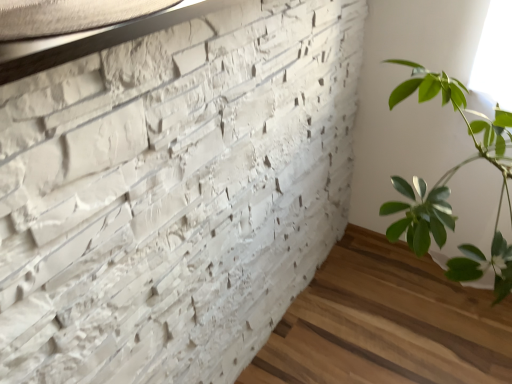
Locate an element on the screen. Image resolution: width=512 pixels, height=384 pixels. white textured brickwork at upper left is located at coordinates (174, 193).

What do you see at coordinates (174, 193) in the screenshot?
I see `white textured brickwork at upper left` at bounding box center [174, 193].

Find the location of a particular element. The height and width of the screenshot is (384, 512). matte white stone at upper left is located at coordinates (104, 40).

What is the approximate width of matte white stone at upper left?

The width of matte white stone at upper left is 15.54 inches.

Describe the element at coordinates (104, 40) in the screenshot. I see `matte white stone at upper left` at that location.

What is the approximate height of matte white stone at upper left?

The height of matte white stone at upper left is 3.90 centimeters.

The width and height of the screenshot is (512, 384). Identify the location of white textured brickwork at upper left. (174, 193).

Considering the positions of objects white textured brickwork at upper left and matte white stone at upper left in the image provided, who is more to the left, white textured brickwork at upper left or matte white stone at upper left?

matte white stone at upper left.

Who is more distant, white textured brickwork at upper left or matte white stone at upper left?

matte white stone at upper left is more distant.

Which is in front, point (144, 148) or point (30, 53)?

The point (30, 53) is more forward.

From the image's perspective, which object appears higher, white textured brickwork at upper left or matte white stone at upper left?

From the image's view, matte white stone at upper left is above.

From a real-world perspective, is white textured brickwork at upper left physically below matte white stone at upper left?

Yes, from a real-world perspective, white textured brickwork at upper left is below matte white stone at upper left.

Considering the sizes of objects white textured brickwork at upper left and matte white stone at upper left in the image provided, who is wider, white textured brickwork at upper left or matte white stone at upper left?

With larger width is white textured brickwork at upper left.

Can you confirm if white textured brickwork at upper left is shorter than matte white stone at upper left?

In fact, white textured brickwork at upper left may be taller than matte white stone at upper left.

Can you confirm if white textured brickwork at upper left is bigger than matte white stone at upper left?

Yes.

Is white textured brickwork at upper left not within matte white stone at upper left?

Yes, white textured brickwork at upper left is outside of matte white stone at upper left.

Are white textured brickwork at upper left and matte white stone at upper left making contact?

No.

Is white textured brickwork at upper left oriented away from matte white stone at upper left?

That's not correct — white textured brickwork at upper left is not looking away from matte white stone at upper left.

Looking at this image, what's the angular difference between white textured brickwork at upper left and matte white stone at upper left's facing directions?

1.24 degrees.

Where is `window sill on the left of white textured brickwork at upper left`? The image size is (512, 384). window sill on the left of white textured brickwork at upper left is located at coordinates (104, 40).

Visually, is matte white stone at upper left positioned to the left or to the right of white textured brickwork at upper left?

matte white stone at upper left is positioned on white textured brickwork at upper left's left side.

Is matte white stone at upper left closer to the viewer compared to white textured brickwork at upper left?

No, it is not.

Does point (198, 12) appear closer or farther from the camera than point (286, 92)?

Clearly, point (198, 12) is closer to the camera than point (286, 92).

From the image's perspective, which object appears higher, matte white stone at upper left or white textured brickwork at upper left?

matte white stone at upper left.

From a real-world perspective, is matte white stone at upper left below white textured brickwork at upper left?

Actually, matte white stone at upper left is physically above white textured brickwork at upper left in the real world.

Does matte white stone at upper left have a lesser width compared to white textured brickwork at upper left?

Yes, matte white stone at upper left is thinner than white textured brickwork at upper left.

Considering the sizes of matte white stone at upper left and white textured brickwork at upper left in the image, is matte white stone at upper left taller or shorter than white textured brickwork at upper left?

Considering their sizes, matte white stone at upper left has less height than white textured brickwork at upper left.

Is matte white stone at upper left bigger or smaller than white textured brickwork at upper left?

matte white stone at upper left is smaller than white textured brickwork at upper left.

Can white textured brickwork at upper left be found inside matte white stone at upper left?

No, white textured brickwork at upper left is not a part of matte white stone at upper left.

Are matte white stone at upper left and white textured brickwork at upper left making contact?

No.

Is matte white stone at upper left positioned with its back to white textured brickwork at upper left?

That's right, matte white stone at upper left is facing away from white textured brickwork at upper left.

You are a GUI agent. You are given a task and a screenshot of the screen. Output one action in this format:
    pyautogui.click(x=<x>, y=<y>)
    Task: Click on the window sill on the left of the white textured brickwork at upper left
    The width and height of the screenshot is (512, 384).
    Given the screenshot: What is the action you would take?
    pyautogui.click(x=104, y=40)

Locate an element on the screen. Image resolution: width=512 pixels, height=384 pixels. window sill on the left of white textured brickwork at upper left is located at coordinates [104, 40].

At what (x,y) coordinates should I click in order to perform the action: click on brickwork on the right side of matte white stone at upper left. Please return your answer as a coordinate pair (x, y). Looking at the image, I should click on (174, 193).